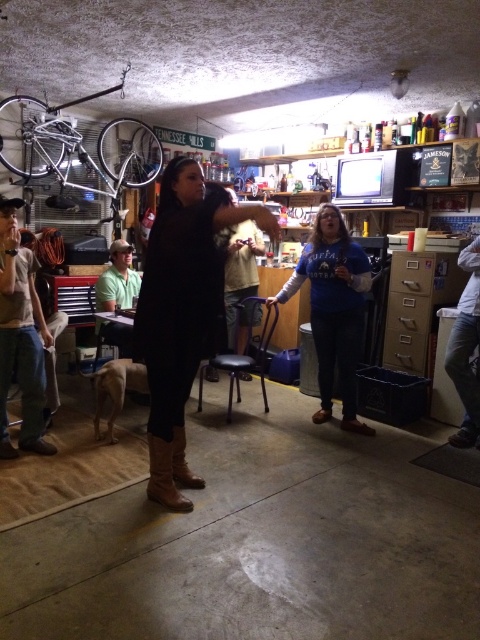
Between brushed metal shirt at left and brown suede boot at center, which one has less height?

With less height is brown suede boot at center.

Can you confirm if brushed metal shirt at left is positioned below brown suede boot at center?

No.

What do you see at coordinates (21, 337) in the screenshot? I see `brushed metal shirt at left` at bounding box center [21, 337].

I want to click on brushed metal shirt at left, so click(21, 337).

Can you confirm if brushed metal shirt at left is taller than fuzzy beige sweater at center?

Yes.

Is point (3, 211) farther from viewer compared to point (252, 266)?

No, (3, 211) is closer to viewer.

Is point (25, 321) positioned in front of point (255, 243)?

Yes, point (25, 321) is closer to viewer.

Find the location of a particular element. brushed metal shirt at left is located at coordinates pos(21,337).

Does fuzzy beige sweater at center have a smaller size compared to brown suede boot at center?

Incorrect, fuzzy beige sweater at center is not smaller in size than brown suede boot at center.

Which of these two, fuzzy beige sweater at center or brown suede boot at center, stands taller?

fuzzy beige sweater at center

What do you see at coordinates (240, 282) in the screenshot?
I see `fuzzy beige sweater at center` at bounding box center [240, 282].

The width and height of the screenshot is (480, 640). What are the coordinates of `fuzzy beige sweater at center` in the screenshot? It's located at (240, 282).